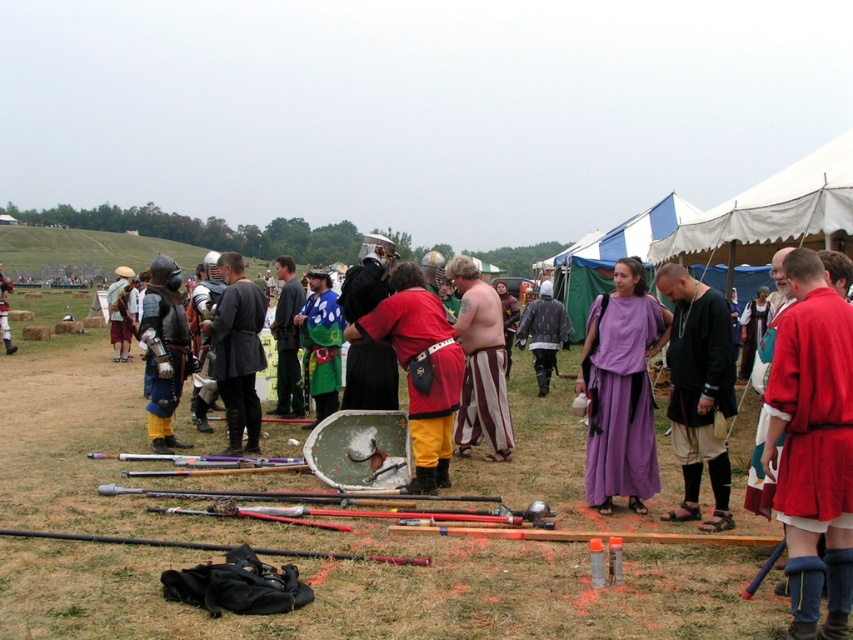
You are a participant in the medieval reenactment and need to retrieve your striped cotton pants at center and leather armor at center from the ground. Which item should you pick up first to reach the one farther away last?

You should pick up the striped cotton pants at center first because it is closer to you than the leather armor at center, so you can reach the leather armor at center last.

You are a participant at the medieval event and need to find your black bag. You are currently standing at point (480,364). Which direction should you move to reach the black bag?

The black bag is located to the right of the point (480,364), so you should move to the right to reach it.

You are a knight in the medieval reenactment event. You need to locate your rubberized red pants at center to prepare for the next performance. Where exactly are they located in the scene?

The rubberized red pants at center are located at point 0.505 on the x axis and 0.478 on the y axis.